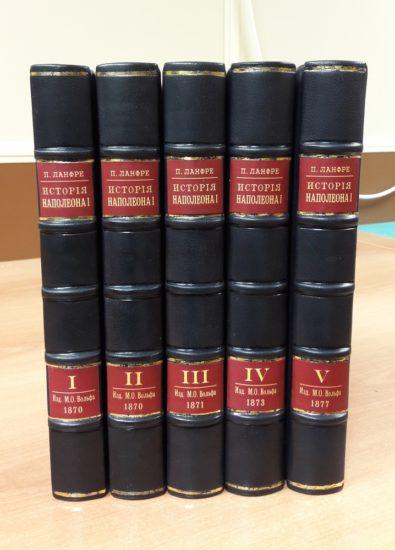
The image size is (395, 550). Find the location of `book spine`. book spine is located at coordinates (78, 442), (261, 444), (314, 441), (194, 441).